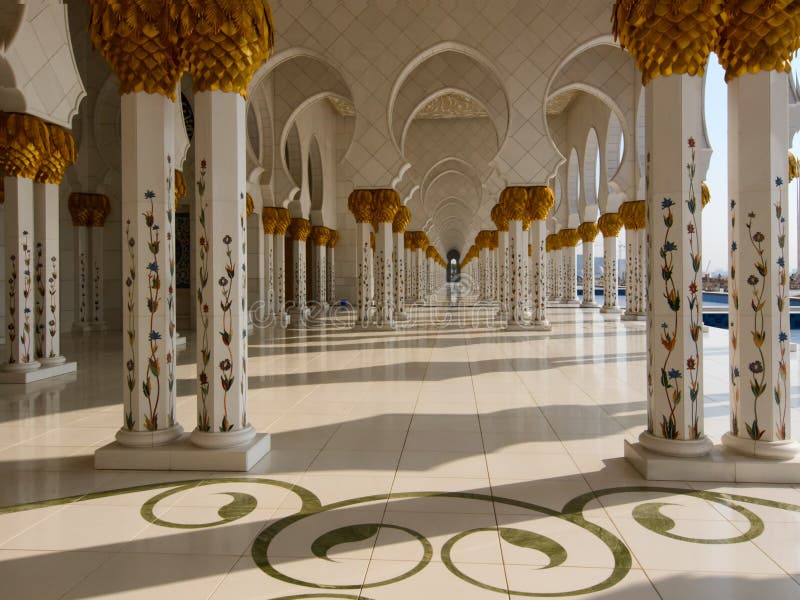
Locate an element on the screen. The width and height of the screenshot is (800, 600). off-white tiled flooring is located at coordinates point(434,433).